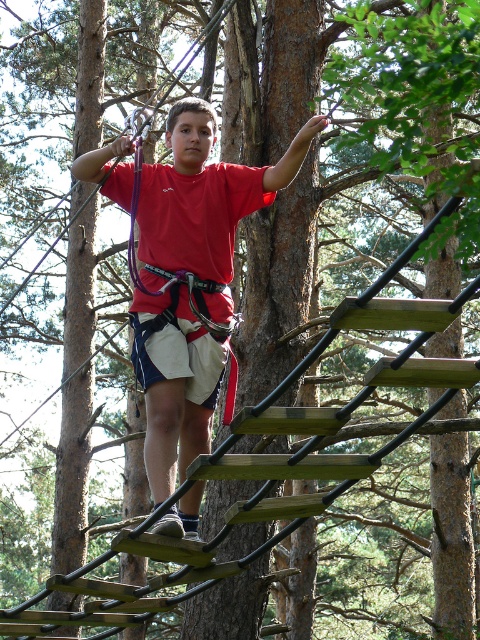
You are a safety inspector reviewing the setup of an adventure course. You notice the red matte shirt at center and the white cotton shorts at center. Which clothing item is closer to the safety harness that is part of the participant equipment?

The red matte shirt at center is closer to the safety harness because it is in front of the white cotton shorts at center, which would place it nearer to the harness attached to the participant.

You are a safety inspector reviewing this ropes course setup. You notice a red matte shirt at center at point (205, 195). According to safety protocols, all participants must wear their harnesses above the waist. Is the harness of the red matte shirt at center positioned correctly?

The red matte shirt at center is located at point (205, 195), but the description does not provide information about the harness position relative to the waist. Therefore, it is impossible to determine if the harness is positioned correctly based on the given information.

You are a photographer trying to capture the participant in the ropes course. You want to ensure the red matte shirt at center and white cotton shorts at center are clearly visible in your photo. Which clothing item should you focus on first to ensure it stands out due to its size?

The red matte shirt at center is bigger than the white cotton shorts at center, so focusing on the red matte shirt at center first will ensure it stands out more in the photo.